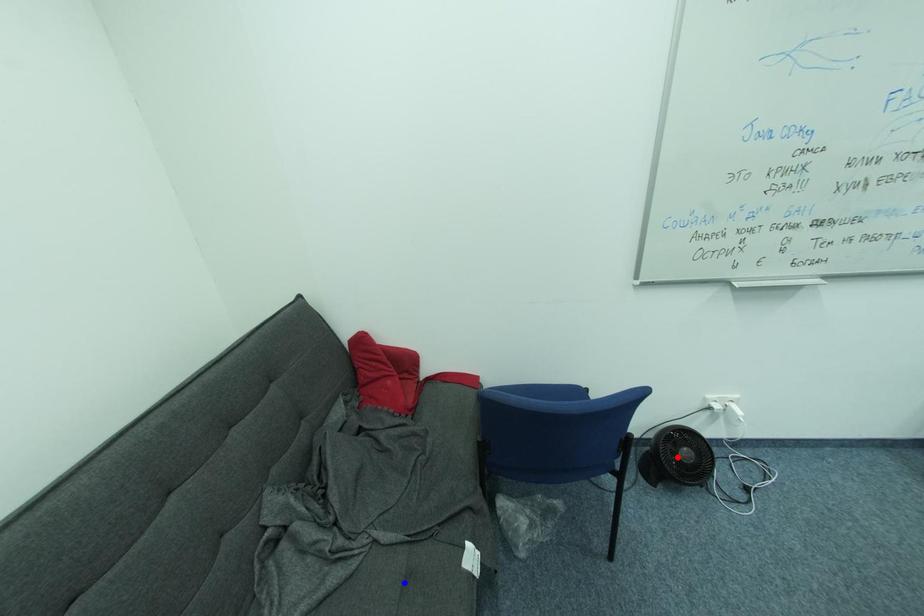
Question: Which of the two points in the image is closer to the camera?

Choices:
 (A) Blue point is closer.
 (B) Red point is closer.

Answer: (A)